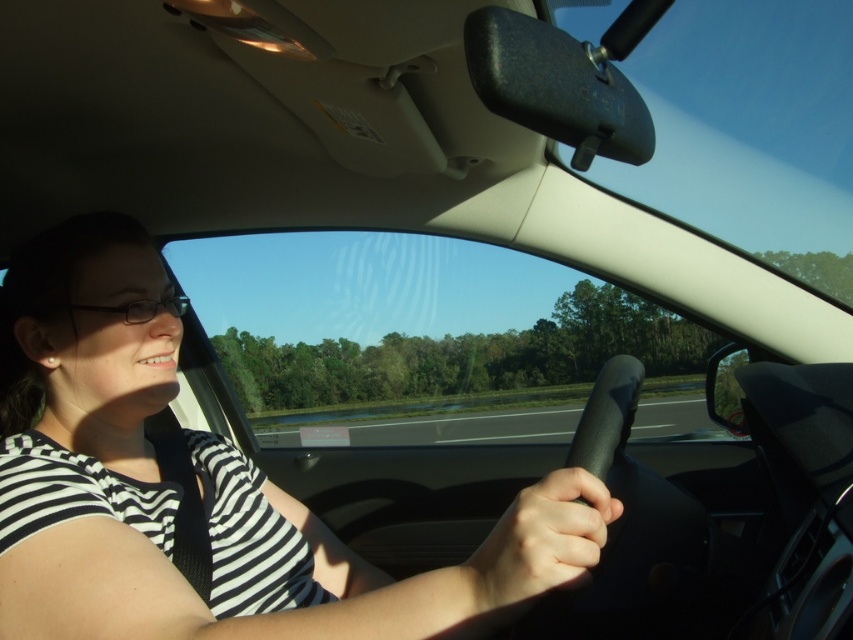
Based on the scene description, where is the white striped shirt at center located in the image?

The white striped shirt at center is located at point 0.767 on the x axis and 0.249 on the y axis.

You are a passenger in the car shown. You notice the clear plastic glasses at left and the asphalt road at center. Which object is closer to you from your current position in the car?

The asphalt road at center is closer to you than the clear plastic glasses at left because the clear plastic glasses at left is behind asphalt road at center.